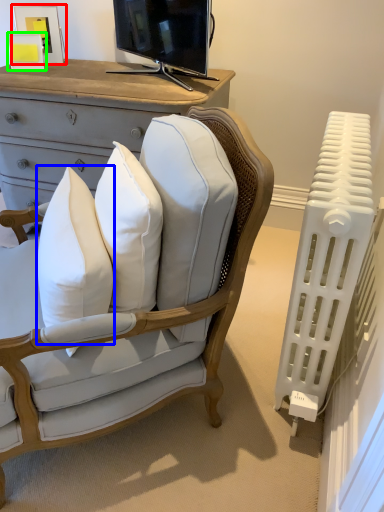
Question: Considering the real-world distances, which object is closest to picture frame (highlighted by a red box)? pillow (highlighted by a blue box) or picture frame (highlighted by a green box).

Choices:
 (A) pillow
 (B) picture frame

Answer: (B)